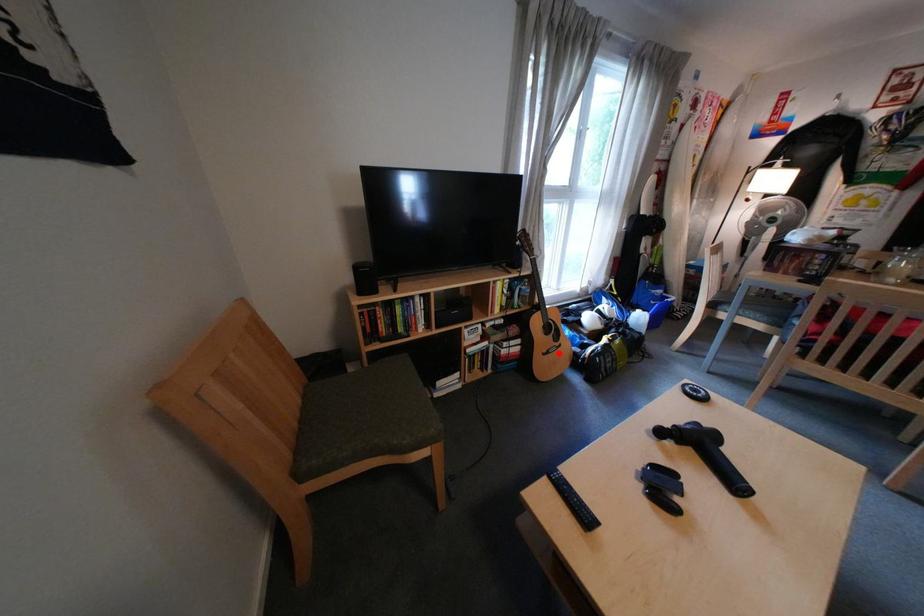
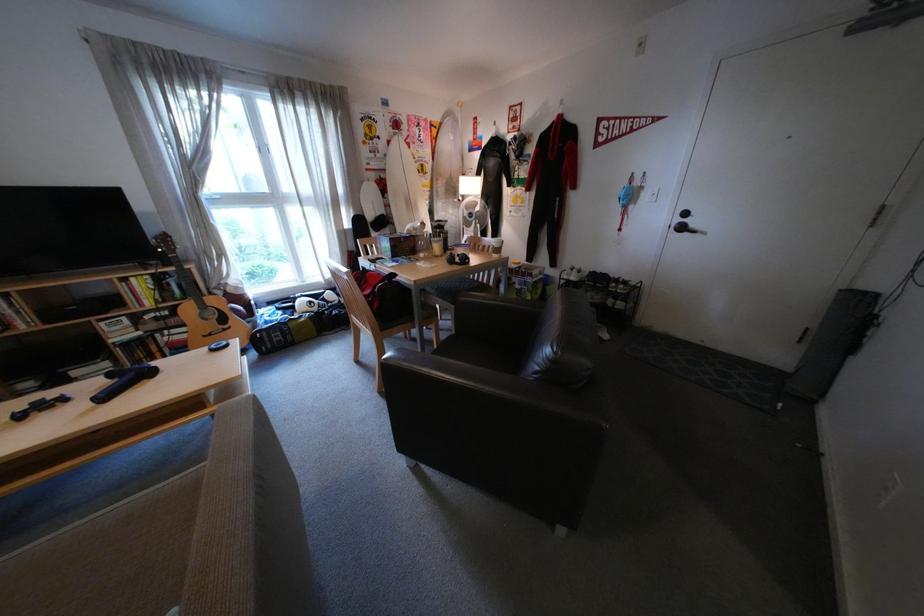
The point at the highlighted location is marked in the first image. Where is the corresponding point in the second image?

(220, 334)